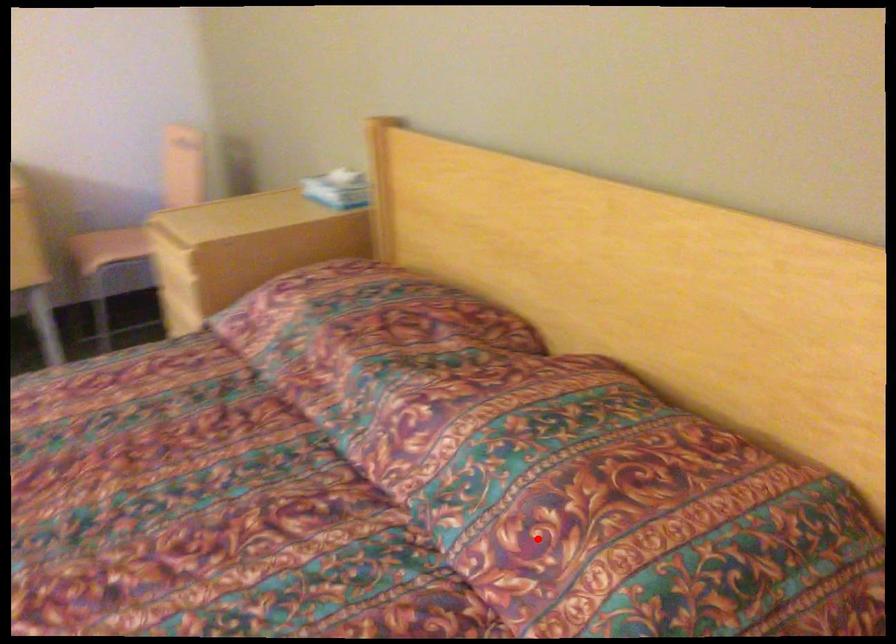
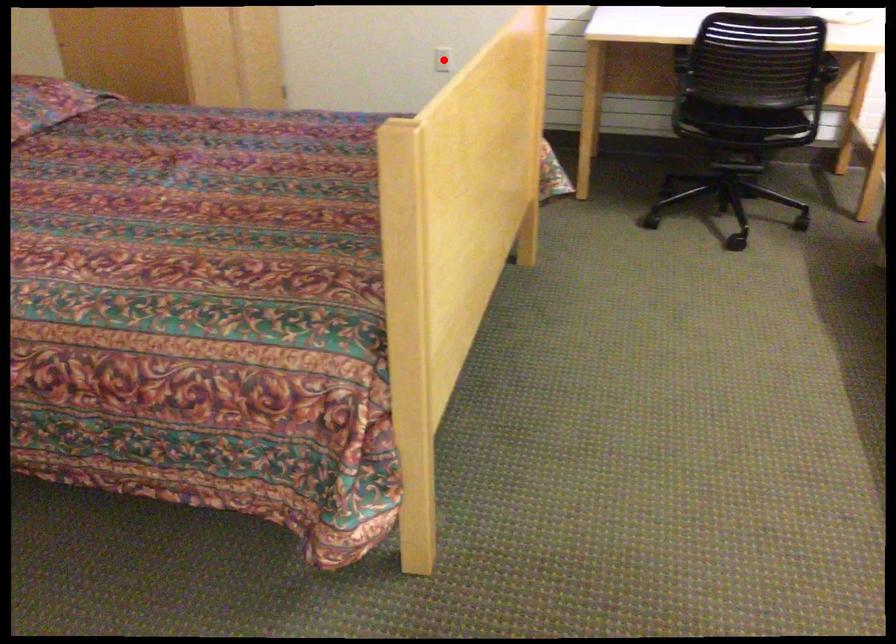
I am providing you with two images of the same scene from different viewpoints. A red point is marked on the first image and another point is marked on the second image. Is the marked point in image1 the same physical position as the marked point in image2?

No